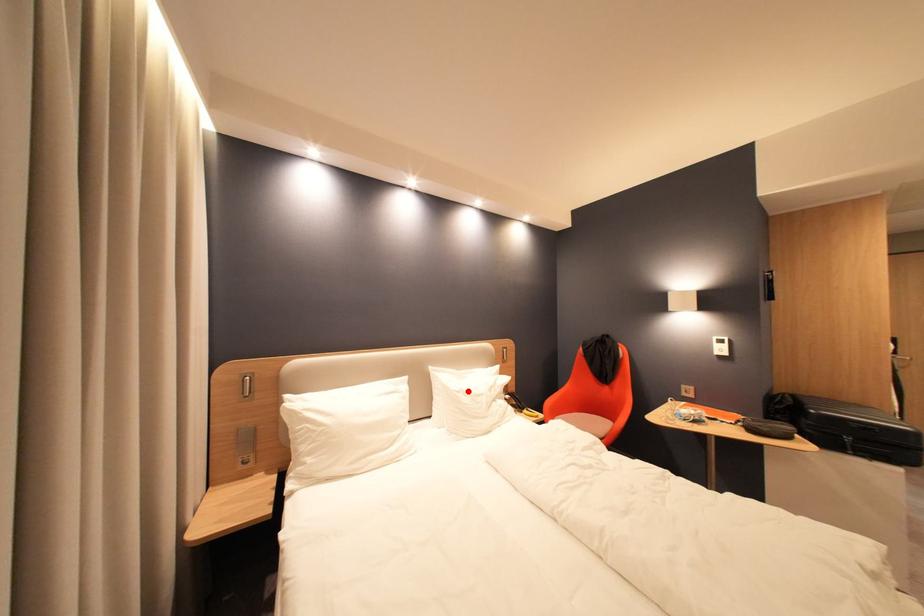
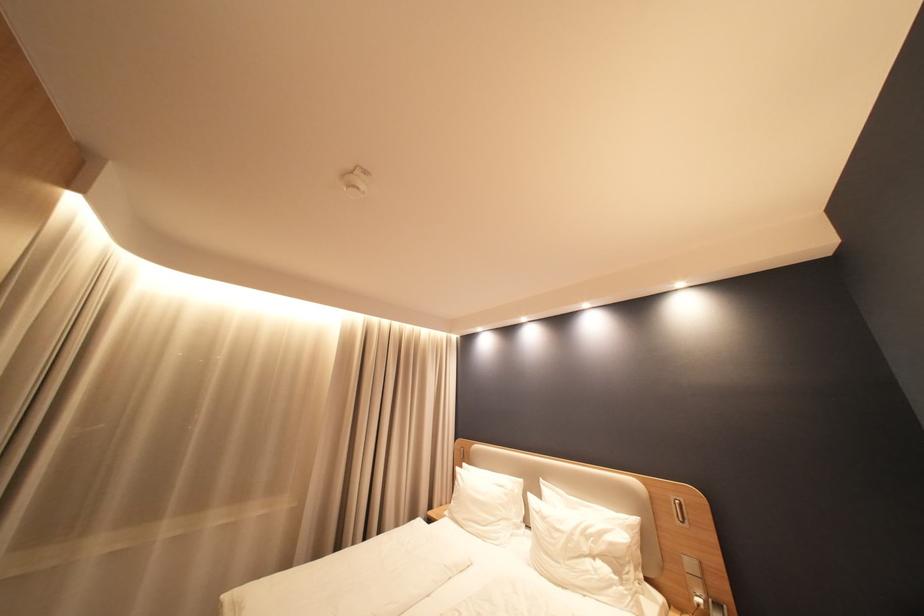
Find the pixel in the second image that matches the highlighted location in the first image.

(546, 511)